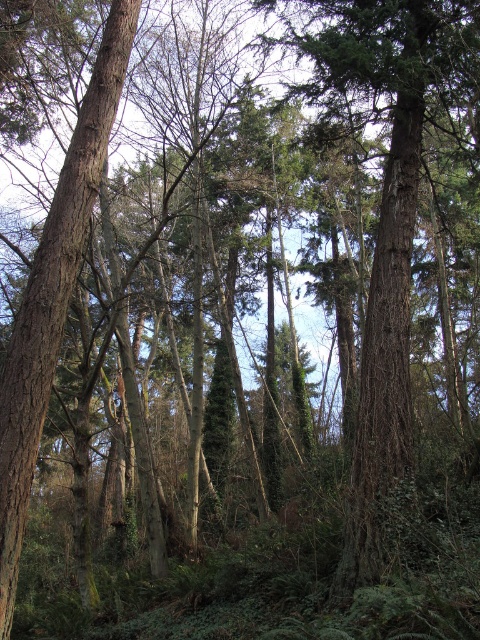
Can you confirm if green rough bark tree at center is shorter than brown rough bark tree at left?

In fact, green rough bark tree at center may be taller than brown rough bark tree at left.

Which is behind, point (462, 38) or point (57, 288)?

The point (462, 38) is more distant.

Identify the location of green rough bark tree at center. (386, 228).